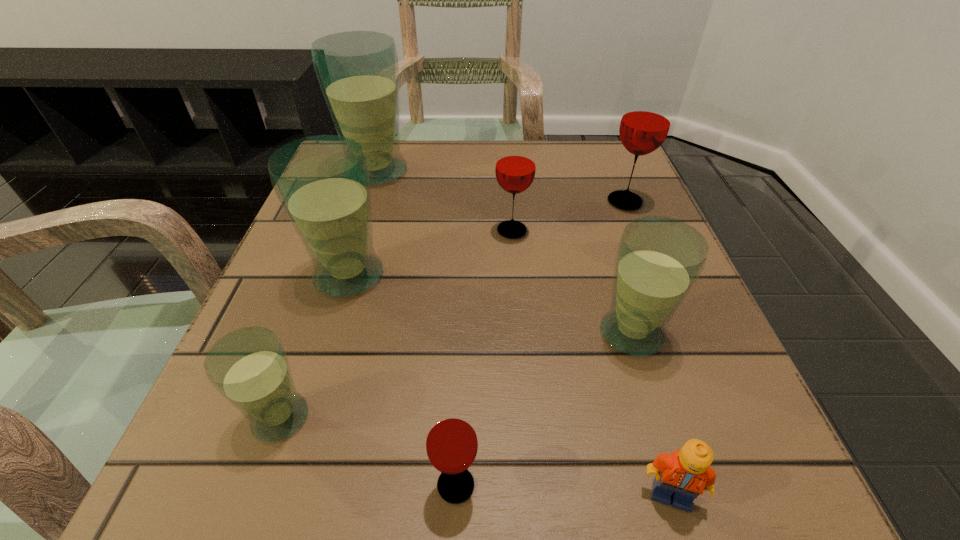
You are a GUI agent. You are given a task and a screenshot of the screen. Output one action in this format:
    pyautogui.click(x=<x>, y=<y>)
    Task: Click on the red glass that stands as the third closest to the shortest object
    Image resolution: width=960 pixels, height=540 pixels.
    Given the screenshot: What is the action you would take?
    pyautogui.click(x=646, y=119)

I want to click on red glass that can be found as the third closest to the third nearest object, so click(646, 119).

Find the location of `vacant space that satisfies the following two spatial constraints: 1. on the back side of the farthest red glass; 2. on the left side of the smallest red glass`. vacant space that satisfies the following two spatial constraints: 1. on the back side of the farthest red glass; 2. on the left side of the smallest red glass is located at coordinates (467, 202).

The image size is (960, 540). I want to click on blank space that satisfies the following two spatial constraints: 1. on the front side of the second nearest glass; 2. on the right side of the nearest glass, so click(x=256, y=485).

The image size is (960, 540). Find the location of `free space that satisfies the following two spatial constraints: 1. on the front side of the fourth object from right to left; 2. on the left side of the fourth nearest object`. free space that satisfies the following two spatial constraints: 1. on the front side of the fourth object from right to left; 2. on the left side of the fourth nearest object is located at coordinates (520, 333).

Where is `vacant region that satisfies the following two spatial constraints: 1. on the back side of the second farthest red glass; 2. on the right side of the fourth nearest glass`? This screenshot has height=540, width=960. vacant region that satisfies the following two spatial constraints: 1. on the back side of the second farthest red glass; 2. on the right side of the fourth nearest glass is located at coordinates (363, 231).